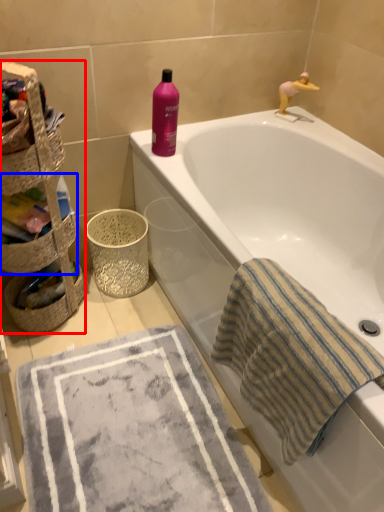
Question: Which object appears farthest to the camera in this image, basket (highlighted by a red box) or basket (highlighted by a blue box)?

Choices:
 (A) basket
 (B) basket

Answer: (B)